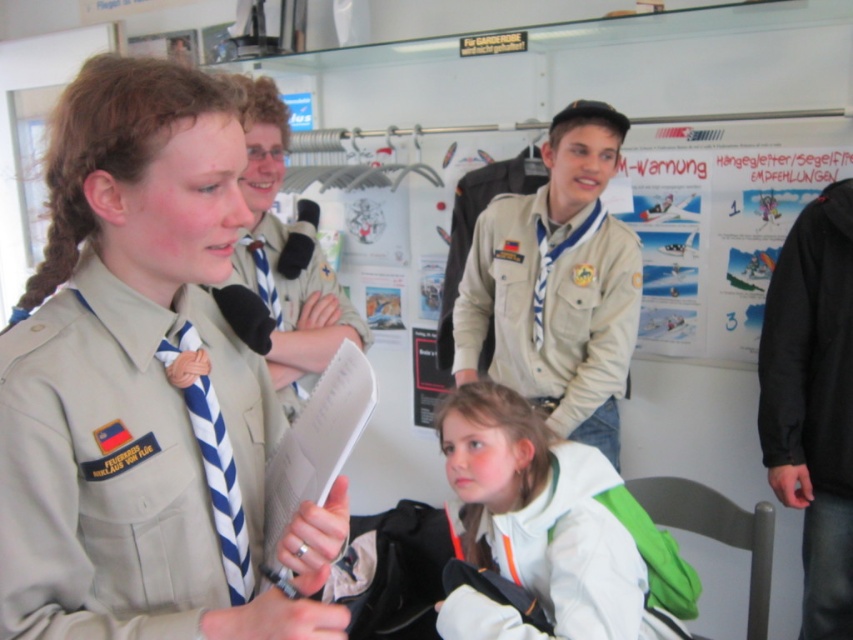
Is white fabric jacket at lower center thinner than blue striped tie at center?

No.

Between point (614, 483) and point (260, 257), which one is positioned in front?

Point (614, 483)

Identify the location of white fabric jacket at lower center. (550, 529).

Consider the image. Does beige fabric uniform at center have a lesser height compared to blue and white striped tie at center?

In fact, beige fabric uniform at center may be taller than blue and white striped tie at center.

Is beige fabric uniform at center closer to the viewer compared to blue and white striped tie at center?

No, it is not.

Between point (473, 244) and point (235, 602), which one is positioned in front?

Point (235, 602)

This screenshot has width=853, height=640. Identify the location of beige fabric uniform at center. (552, 310).

Is khaki fabric uniform at center wider than blue/white striped tie at center?

Incorrect, khaki fabric uniform at center's width does not surpass blue/white striped tie at center's.

Locate an element on the screen. This screenshot has height=640, width=853. khaki fabric uniform at center is located at coordinates pos(119,464).

At what (x,y) coordinates should I click in order to perform the action: click on khaki fabric uniform at center. Please return your answer as a coordinate pair (x, y). Image resolution: width=853 pixels, height=640 pixels. Looking at the image, I should click on (119, 464).